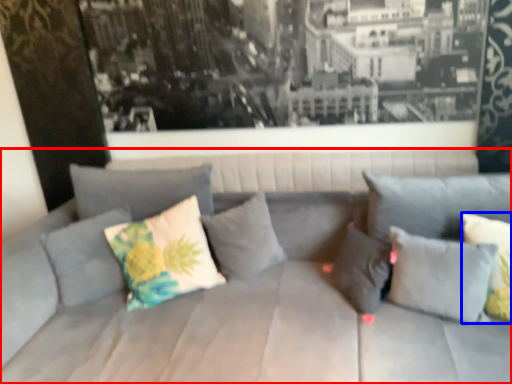
Question: Which object is closer to the camera taking this photo, studio couch (highlighted by a red box) or pillow (highlighted by a blue box)?

Choices:
 (A) studio couch
 (B) pillow

Answer: (A)